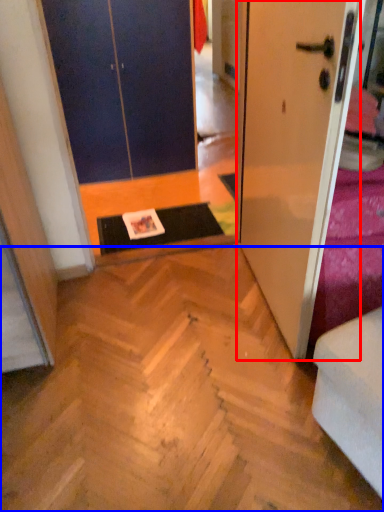
Question: Which point is closer to the camera, door (highlighted by a red box) or stairwell (highlighted by a blue box)?

Choices:
 (A) door
 (B) stairwell

Answer: (A)